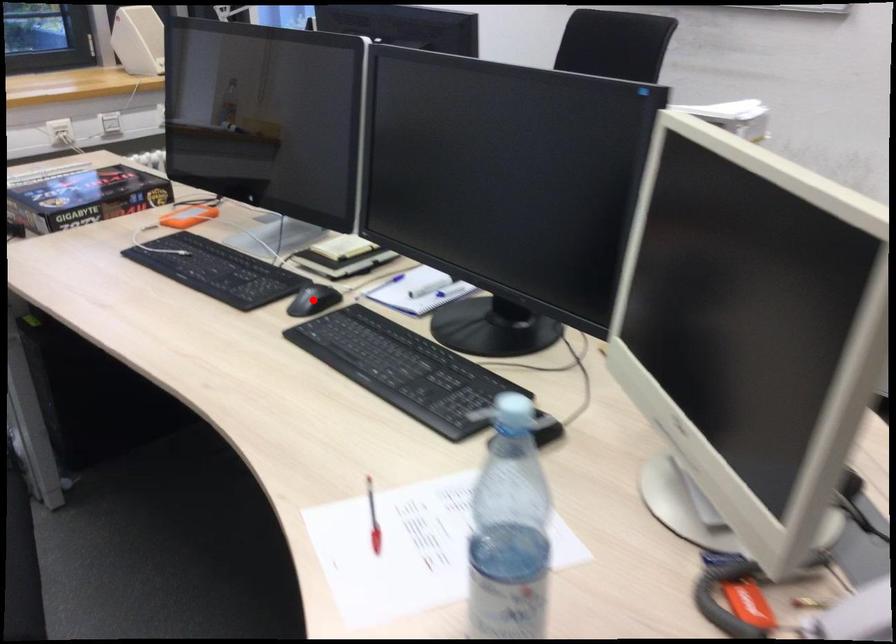
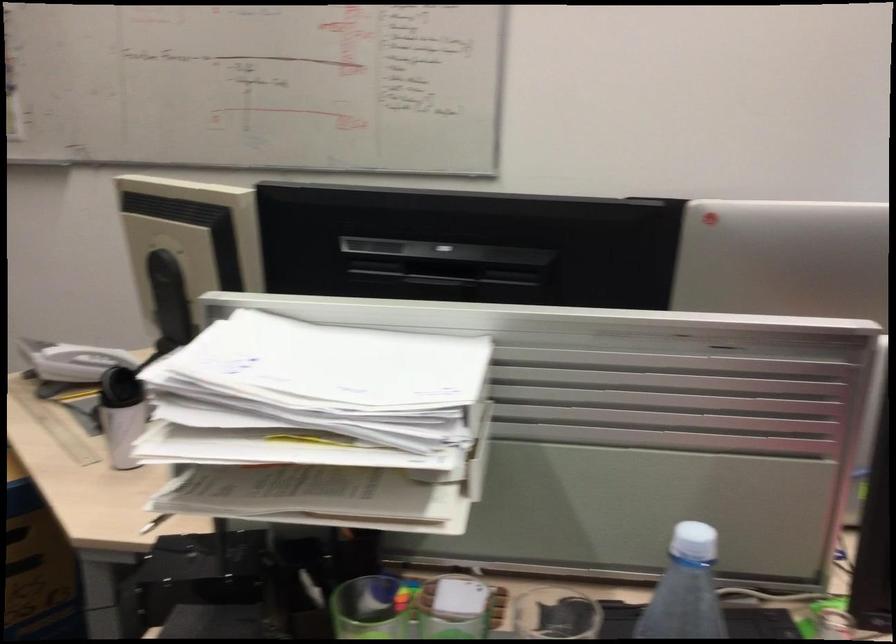
Question: I am providing you with two images of the same scene from different viewpoints. A red point is marked on the first image. Can you still see the location of the red point in image 2?

Choices:
 (A) Yes
 (B) No

Answer: (B)